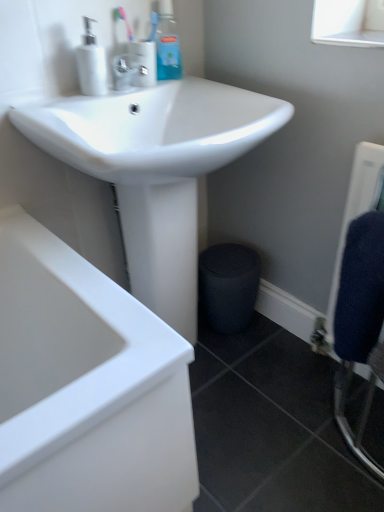
This screenshot has width=384, height=512. In order to click on white glossy soap dispenser at upper left in this screenshot , I will do `click(91, 63)`.

What is the approximate width of satin nickel faucet at upper center, placed as the 1th toiletry when sorted from left to right?

3.72 inches.

How much space does blue plastic bottle at upper center, the 2th toiletry when ordered from left to right, occupy horizontally?

It is 1.88 inches.

At what (x,y) coordinates should I click in order to perform the action: click on white glossy soap dispenser at upper left. Please return your answer as a coordinate pair (x, y). Looking at the image, I should click on (91, 63).

Considering the relative positions of blue plastic bottle at upper center, the 2th toiletry when ordered from left to right, and pink plastic toothbrush at upper center in the image provided, is blue plastic bottle at upper center, the 2th toiletry when ordered from left to right, behind pink plastic toothbrush at upper center?

Yes, it is.

From a real-world perspective, between blue plastic bottle at upper center, the 2th toiletry when ordered from left to right, and pink plastic toothbrush at upper center, who is vertically lower?

blue plastic bottle at upper center, the 2th toiletry when ordered from left to right.

Is blue plastic bottle at upper center, the 2th toiletry when ordered from left to right, with pink plastic toothbrush at upper center?

No, blue plastic bottle at upper center, the 2th toiletry when ordered from left to right, is not in contact with pink plastic toothbrush at upper center.

Can you confirm if white glossy soap dispenser at upper left is bigger than pink plastic toothbrush at upper center?

Yes, white glossy soap dispenser at upper left is bigger than pink plastic toothbrush at upper center.

From a real-world perspective, is white glossy soap dispenser at upper left located beneath pink plastic toothbrush at upper center?

Yes, from a real-world perspective, white glossy soap dispenser at upper left is beneath pink plastic toothbrush at upper center.

Can you tell me how much white glossy soap dispenser at upper left and pink plastic toothbrush at upper center differ in facing direction?

The angle between the facing direction of white glossy soap dispenser at upper left and the facing direction of pink plastic toothbrush at upper center is 4.17 degrees.

From the picture: Which of these two, white glossy soap dispenser at upper left or pink plastic toothbrush at upper center, is wider?

With larger width is white glossy soap dispenser at upper left.

Which is more to the left, white glossy faucet at upper center or dark blue textured towel at right?

white glossy faucet at upper center.

Do you think white glossy faucet at upper center is within dark blue textured towel at right, or outside of it?

The correct answer is: outside.

Looking at the image, does white glossy faucet at upper center seem bigger or smaller compared to dark blue textured towel at right?

white glossy faucet at upper center is smaller than dark blue textured towel at right.

From a real-world perspective, is white glossy faucet at upper center positioned over dark blue textured towel at right based on gravity?

Yes, from a real-world perspective, white glossy faucet at upper center is over dark blue textured towel at right

Is blue plastic bottle at upper center, the 2th toiletry when ordered from left to right, wider or thinner than white glossy sink at upper center?

Considering their sizes, blue plastic bottle at upper center, the 2th toiletry when ordered from left to right, looks slimmer than white glossy sink at upper center.

Is blue plastic bottle at upper center, the 2th toiletry when ordered from left to right, to the left or to the right of white glossy sink at upper center in the image?

Clearly, blue plastic bottle at upper center, the 2th toiletry when ordered from left to right, is on the left of white glossy sink at upper center in the image.

Is blue plastic bottle at upper center, the 1th toiletry in the right-to-left sequence, bigger than white glossy sink at upper center?

Incorrect, blue plastic bottle at upper center, the 1th toiletry in the right-to-left sequence, is not larger than white glossy sink at upper center.

Is white glossy sink at upper center at the back of blue plastic bottle at upper center, the 2th toiletry when ordered from left to right?

blue plastic bottle at upper center, the 2th toiletry when ordered from left to right, is not turned away from white glossy sink at upper center.

Considering the relative sizes of white glossy sink at upper center and satin nickel faucet at upper center, which appears as the 2th toiletry when viewed from the right, in the image provided, is white glossy sink at upper center shorter than satin nickel faucet at upper center, which appears as the 2th toiletry when viewed from the right,?

No, white glossy sink at upper center is not shorter than satin nickel faucet at upper center, which appears as the 2th toiletry when viewed from the right.

Is white glossy sink at upper center turned away from satin nickel faucet at upper center, which appears as the 2th toiletry when viewed from the right?

No, white glossy sink at upper center's orientation is not away from satin nickel faucet at upper center, which appears as the 2th toiletry when viewed from the right.

From a real-world perspective, is white glossy sink at upper center positioned above or below satin nickel faucet at upper center, which appears as the 2th toiletry when viewed from the right?

From a real-world perspective, white glossy sink at upper center is physically below satin nickel faucet at upper center, which appears as the 2th toiletry when viewed from the right.

Does white glossy sink at upper center have a smaller size compared to satin nickel faucet at upper center, which appears as the 2th toiletry when viewed from the right?

No.

In the scene shown: How much distance is there between satin nickel faucet at upper center, which appears as the 2th toiletry when viewed from the right, and blue plastic bottle at upper center, the 2th toiletry when ordered from left to right?

satin nickel faucet at upper center, which appears as the 2th toiletry when viewed from the right, and blue plastic bottle at upper center, the 2th toiletry when ordered from left to right, are 3.80 inches apart from each other.

Can we say satin nickel faucet at upper center, which appears as the 2th toiletry when viewed from the right, lies outside blue plastic bottle at upper center, the 1th toiletry in the right-to-left sequence?

Yes, satin nickel faucet at upper center, which appears as the 2th toiletry when viewed from the right, is outside of blue plastic bottle at upper center, the 1th toiletry in the right-to-left sequence.

From the image's perspective, is satin nickel faucet at upper center, which appears as the 2th toiletry when viewed from the right, positioned above or below blue plastic bottle at upper center, the 2th toiletry when ordered from left to right?

From the image's perspective, satin nickel faucet at upper center, which appears as the 2th toiletry when viewed from the right, appears below blue plastic bottle at upper center, the 2th toiletry when ordered from left to right.

Which object is positioned more to the right, satin nickel faucet at upper center, placed as the 1th toiletry when sorted from left to right, or blue plastic bottle at upper center, the 2th toiletry when ordered from left to right?

blue plastic bottle at upper center, the 2th toiletry when ordered from left to right.

Considering the points (338, 310) and (247, 123), which point is behind, point (338, 310) or point (247, 123)?

The point (247, 123) is farther.

Is dark blue textured towel at right not within white glossy sink at upper center?

Yes, dark blue textured towel at right is outside of white glossy sink at upper center.

Is dark blue textured towel at right looking in the opposite direction of white glossy sink at upper center?

No.

From a real-world perspective, between dark blue textured towel at right and white glossy sink at upper center, who is vertically higher?

dark blue textured towel at right is physically above.

The height and width of the screenshot is (512, 384). I want to click on toiletry that is the 1st one below the pink plastic toothbrush at upper center (from a real-world perspective), so click(167, 44).

Identify the location of soap dispenser below the pink plastic toothbrush at upper center (from the image's perspective). The width and height of the screenshot is (384, 512). (91, 63).

From the picture: Based on their spatial positions, is white glossy soap dispenser at upper left or blue plastic bottle at upper center, the 1th toiletry in the right-to-left sequence, further from dark blue textured towel at right?

The object further to dark blue textured towel at right is blue plastic bottle at upper center, the 1th toiletry in the right-to-left sequence.

Looking at the image, which one is located closer to white glossy soap dispenser at upper left, pink plastic toothbrush at upper center or satin nickel faucet at upper center, placed as the 1th toiletry when sorted from left to right?

The object closer to white glossy soap dispenser at upper left is satin nickel faucet at upper center, placed as the 1th toiletry when sorted from left to right.

Based on their spatial positions, is satin nickel faucet at upper center, placed as the 1th toiletry when sorted from left to right, or white glossy soap dispenser at upper left closer to white glossy sink at upper center?

Based on the image, white glossy soap dispenser at upper left appears to be nearer to white glossy sink at upper center.

When comparing their distances from white glossy soap dispenser at upper left, does pink plastic toothbrush at upper center or dark blue textured towel at right seem further?

dark blue textured towel at right.

Estimate the real-world distances between objects in this image. Which object is closer to blue plastic bottle at upper center, the 1th toiletry in the right-to-left sequence, pink plastic toothbrush at upper center or satin nickel faucet at upper center, which appears as the 2th toiletry when viewed from the right?

satin nickel faucet at upper center, which appears as the 2th toiletry when viewed from the right, is closer to blue plastic bottle at upper center, the 1th toiletry in the right-to-left sequence.

Looking at the image, which one is located further to white glossy soap dispenser at upper left, white glossy sink at upper center or dark blue textured towel at right?

dark blue textured towel at right.

Looking at the image, which one is located closer to dark blue textured towel at right, pink plastic toothbrush at upper center or white glossy sink at upper center?

white glossy sink at upper center is positioned closer to the anchor dark blue textured towel at right.

Considering their positions, is dark blue textured towel at right positioned further to blue plastic bottle at upper center, the 2th toiletry when ordered from left to right, than white glossy soap dispenser at upper left?

Based on the image, dark blue textured towel at right appears to be further to blue plastic bottle at upper center, the 2th toiletry when ordered from left to right.

You are a GUI agent. You are given a task and a screenshot of the screen. Output one action in this format:
    pyautogui.click(x=<x>, y=<y>)
    Task: Click on the toiletry between pink plastic toothbrush at upper center and blue plastic bottle at upper center, the 1th toiletry in the right-to-left sequence, in the horizontal direction
    This screenshot has height=512, width=384.
    Given the screenshot: What is the action you would take?
    pos(144,62)

Locate an element on the screen. toiletry between pink plastic toothbrush at upper center and white glossy faucet at upper center in the vertical direction is located at coordinates (144, 62).

Where is `sink located between white glossy soap dispenser at upper left and dark blue textured towel at right in the left-right direction`? sink located between white glossy soap dispenser at upper left and dark blue textured towel at right in the left-right direction is located at coordinates (x=156, y=169).

This screenshot has width=384, height=512. Find the location of `tap located between white glossy soap dispenser at upper left and dark blue textured towel at right in the left-right direction`. tap located between white glossy soap dispenser at upper left and dark blue textured towel at right in the left-right direction is located at coordinates (128, 71).